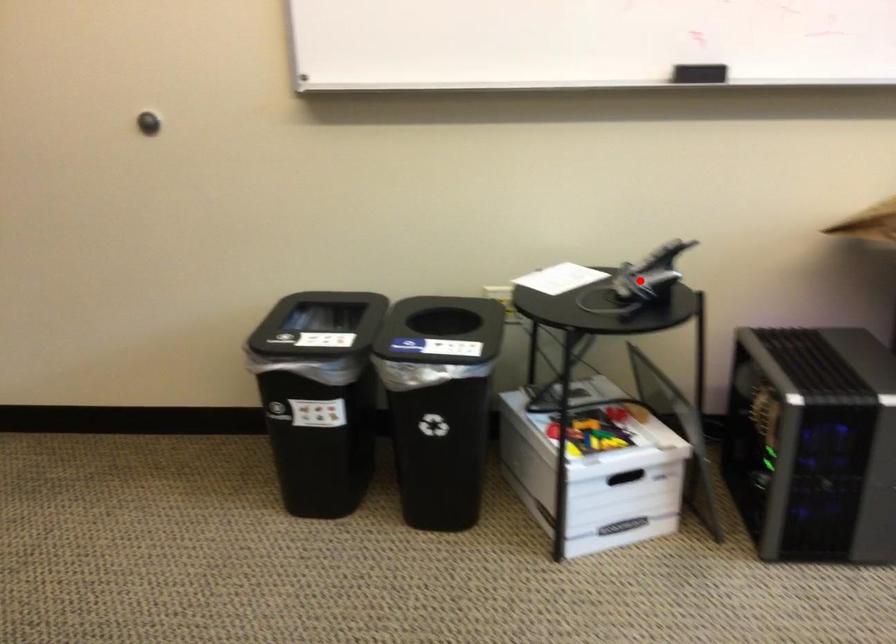
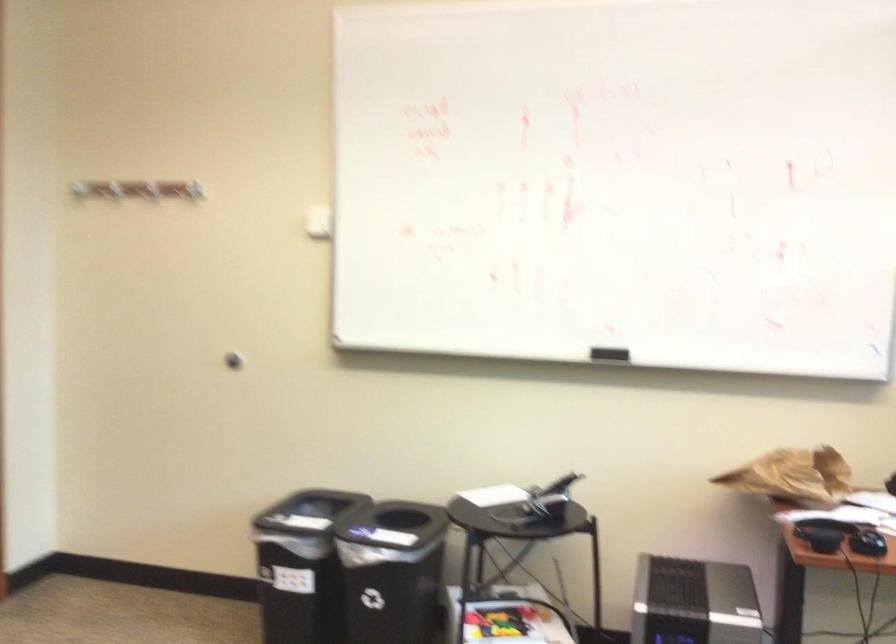
Question: I am providing you with two images of the same scene from different viewpoints. Given a red point in image1, look at the same physical point in image2. Is it:

Choices:
 (A) Closer to the viewpoint
 (B) Farther from the viewpoint

Answer: (B)